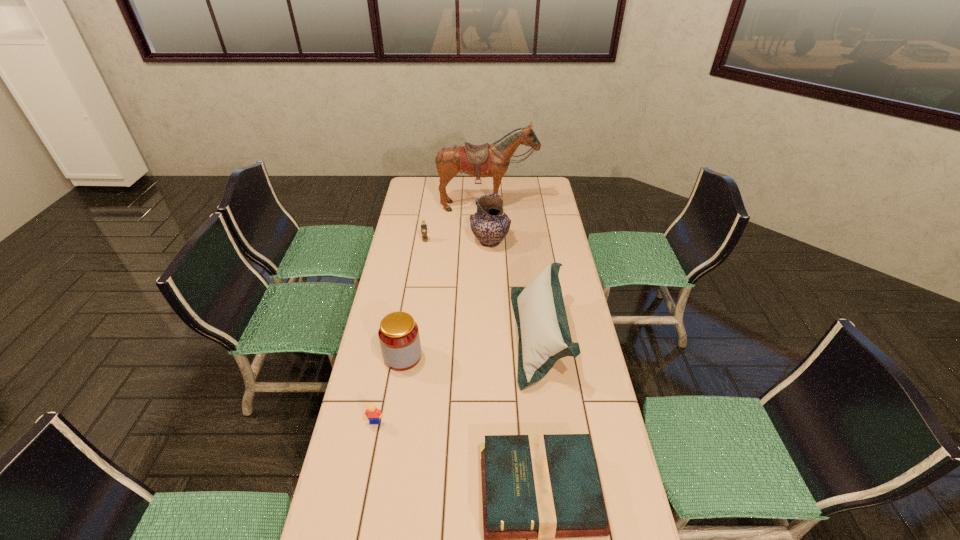
This screenshot has width=960, height=540. In order to click on saddle in this screenshot , I will do `click(480, 161)`.

I want to click on the tallest object, so click(480, 161).

At what (x,y) coordinates should I click in order to perform the action: click on the sixth shortest object. Please return your answer as a coordinate pair (x, y). Looking at the image, I should click on (490, 225).

You are a GUI agent. You are given a task and a screenshot of the screen. Output one action in this format:
    pyautogui.click(x=<x>, y=<y>)
    Task: Click on the cushion
    Image resolution: width=960 pixels, height=540 pixels.
    Given the screenshot: What is the action you would take?
    pyautogui.click(x=544, y=337)

The height and width of the screenshot is (540, 960). Find the location of `jar`. jar is located at coordinates (399, 338).

Find the location of a particular element. The width and height of the screenshot is (960, 540). soda is located at coordinates (423, 225).

The width and height of the screenshot is (960, 540). Find the location of `Lego`. Lego is located at coordinates (373, 414).

At what (x,y) coordinates should I click in order to perform the action: click on vacant position located 0.290m on the back of the farthest object. Please return your answer as a coordinate pair (x, y). This screenshot has width=960, height=540. Looking at the image, I should click on (488, 248).

Identify the location of vacant space located on the back of the pottery. This screenshot has width=960, height=540. (489, 195).

Find the location of a particular element. The image size is (960, 540). free location located on the surface of the cushion is located at coordinates (454, 336).